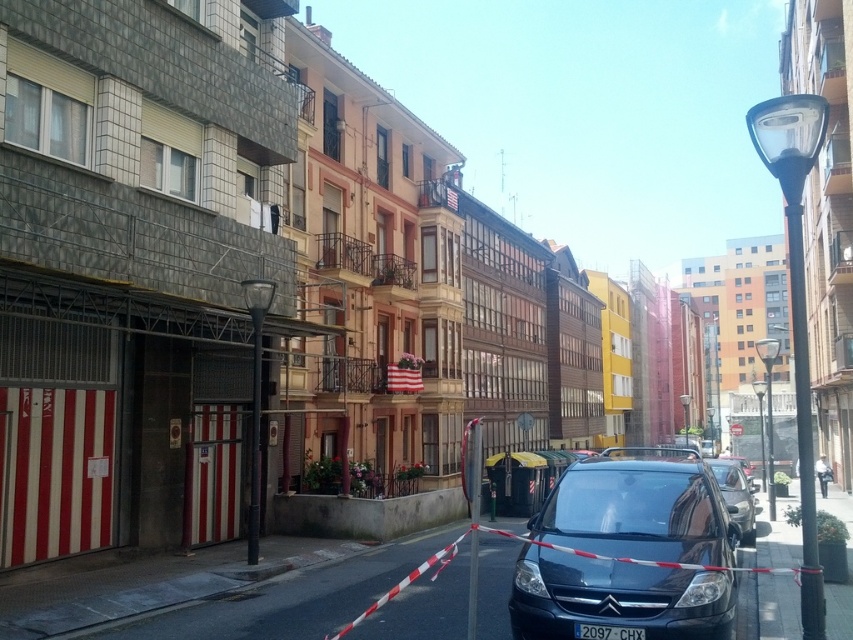
Question: Estimate the real-world distances between objects in this image. Which object is closer to the shiny black car at center?

Choices:
 (A) shiny blue car at center
 (B) black plastic license plate at center

Answer: (A)

Question: Can you confirm if shiny black car at center is thinner than black plastic license plate at center?

Choices:
 (A) yes
 (B) no

Answer: (B)

Question: Is shiny black car at center to the left of black plastic license plate at center from the viewer's perspective?

Choices:
 (A) yes
 (B) no

Answer: (B)

Question: Which is nearer to the black plastic license plate at center?

Choices:
 (A) shiny blue car at center
 (B) shiny black car at center

Answer: (A)

Question: Is shiny black car at center positioned at the back of black plastic license plate at center?

Choices:
 (A) no
 (B) yes

Answer: (B)

Question: Which object is farther from the camera taking this photo?

Choices:
 (A) shiny blue car at center
 (B) shiny black car at center
 (C) black plastic license plate at center

Answer: (B)